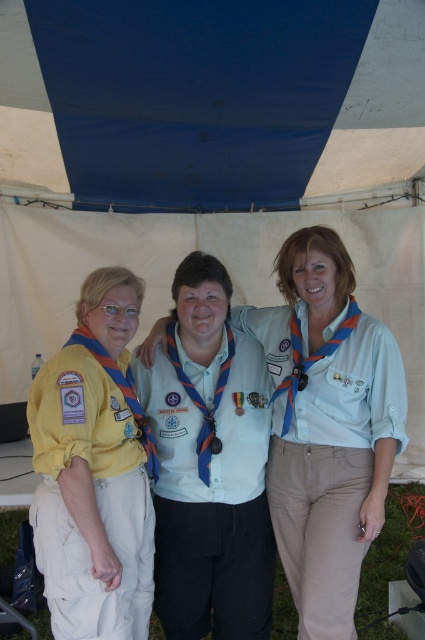
You are organizing a group photo and need to ensure everyone fits within a 3 meter wide frame. The blue fabric uniform at center and yellow fabric uniform at left are part of the group. Can you confirm if the total width of these two uniforms combined will fit within the frame?

The blue fabric uniform at center might be wider than yellow fabric uniform at left, but without exact measurements, it is uncertain if their combined width will fit within the 3 meter frame. Additional information is needed to confirm.

You are a photographer trying to capture a group photo of the light blue cotton shirt at center and the yellow fabric uniform at left. The camera you have can only focus on objects within a 20 inch range. Will both subjects be in focus?

The light blue cotton shirt at center and yellow fabric uniform at left are 21.74 inches apart, which exceeds the camera focus range of 20 inches. Therefore, both subjects will not be in focus.

You are organizing a uniform fitting session for scouts. You have a new uniform that needs to be tailored to match the existing ones. The light blue cotton shirt at center and the yellow fabric uniform at left are examples. Which uniform should you use as a reference for the width to ensure the new uniform fits properly?

The light blue cotton shirt at center has a larger width than the yellow fabric uniform at left, so you should use the light blue cotton shirt at center as the reference for the width to ensure the new uniform fits properly.